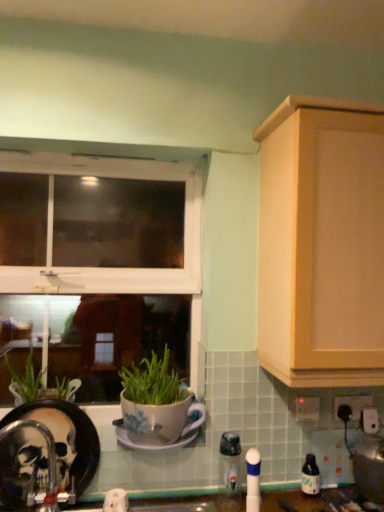
You are a GUI agent. You are given a task and a screenshot of the screen. Output one action in this format:
    pyautogui.click(x=<x>, y=<y>)
    Task: Click on the free space to the left of metallic silver toaster at lower right, placed as the 2th appliance when sorted from left to right
    The width and height of the screenshot is (384, 512).
    Given the screenshot: What is the action you would take?
    pyautogui.click(x=337, y=494)